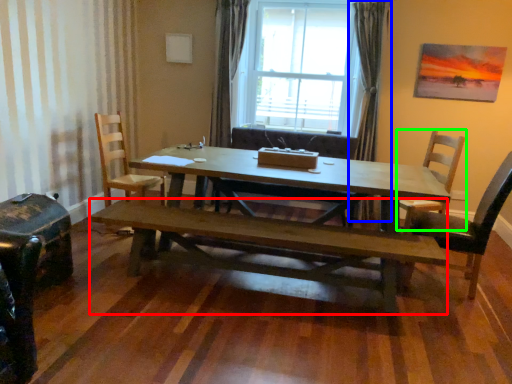
Question: Which is nearer to the bench (highlighted by a red box)? curtain (highlighted by a blue box) or chair (highlighted by a green box).

Choices:
 (A) curtain
 (B) chair

Answer: (B)